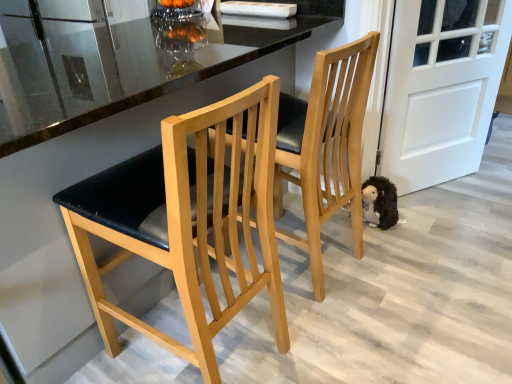
Question: Relative to white matte door at right, is fuzzy brown plush at lower right in front or behind?

Choices:
 (A) front
 (B) behind

Answer: (B)

Question: From the image's perspective, is fuzzy brown plush at lower right positioned above or below white matte door at right?

Choices:
 (A) below
 (B) above

Answer: (A)

Question: Which object is the closest to the matte wood chair at center, which is counted as the 1th chair, starting from the right?

Choices:
 (A) white matte door at right
 (B) fuzzy brown plush at lower right
 (C) matte black seat at center, acting as the second chair starting from the right

Answer: (C)

Question: Estimate the real-world distances between objects in this image. Which object is farther from the matte wood chair at center, which is counted as the 1th chair, starting from the right?

Choices:
 (A) matte black seat at center, acting as the second chair starting from the right
 (B) fuzzy brown plush at lower right
 (C) white matte door at right

Answer: (C)